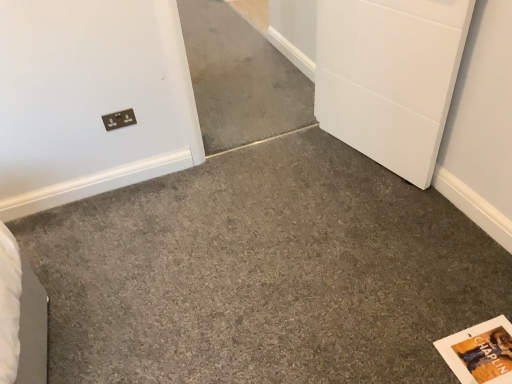
This screenshot has width=512, height=384. Find the location of `metallic silver outlet at upper left`. metallic silver outlet at upper left is located at coordinates (119, 119).

What do you see at coordinates (119, 119) in the screenshot? The image size is (512, 384). I see `metallic silver outlet at upper left` at bounding box center [119, 119].

Locate an element on the screen. The image size is (512, 384). metallic silver outlet at upper left is located at coordinates (119, 119).